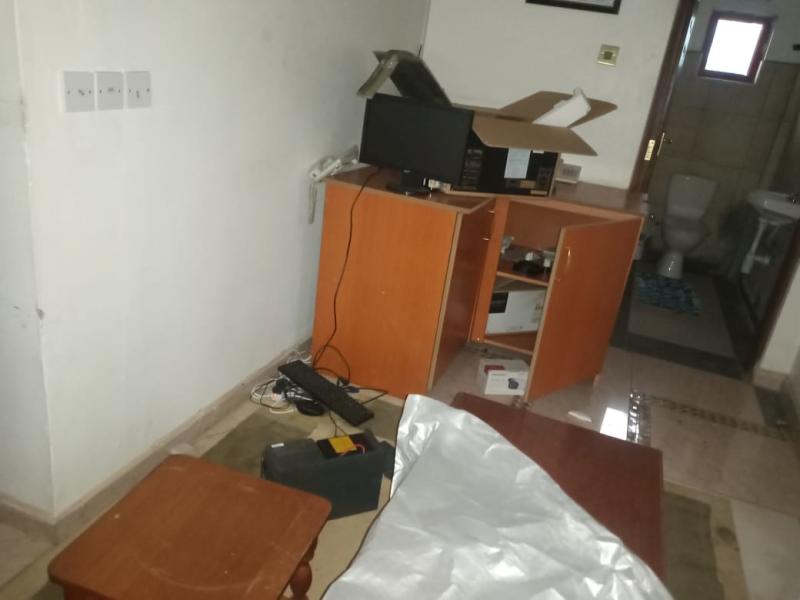
Find the location of a particular element. The height and width of the screenshot is (600, 800). walls is located at coordinates (178, 204), (14, 256), (517, 57), (756, 117).